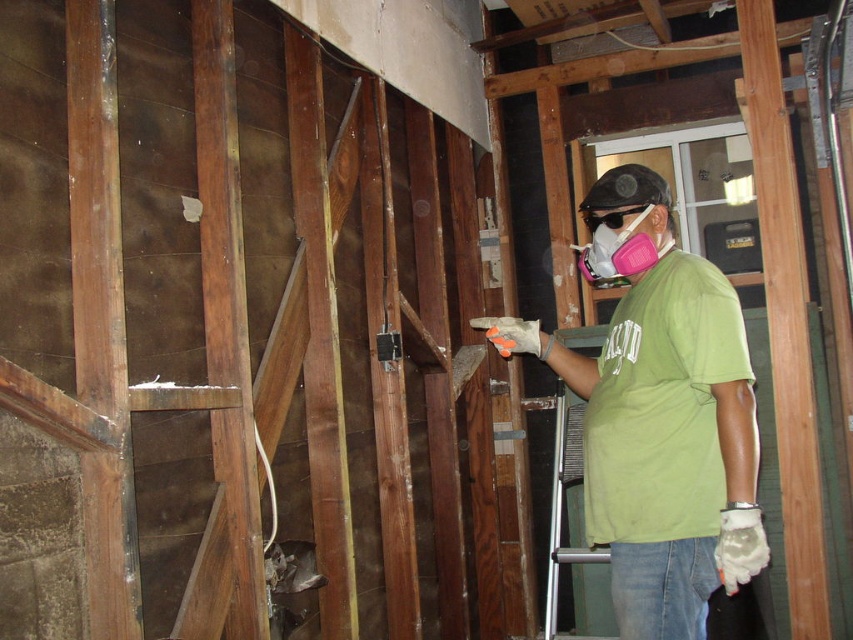
You are a safety inspector checking the construction site. You notice the green matte shirt at center and the pink foam respirator at center. Which item is bigger in size?

The green matte shirt at center is larger in size compared to the pink foam respirator at center.